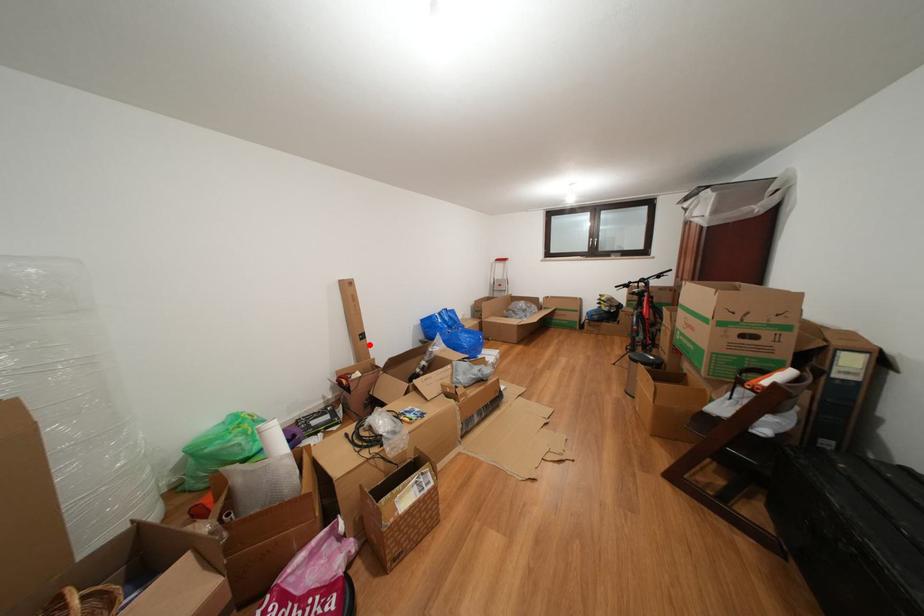
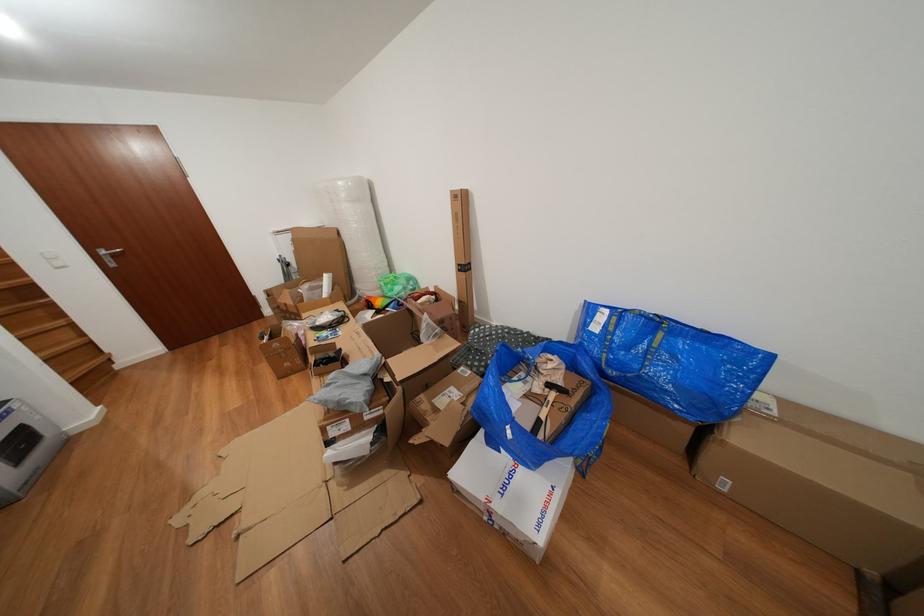
Question: I am providing you with two images of the same scene from different viewpoints. Given a red point in image1, look at the same physical point in image2. Is it:

Choices:
 (A) Closer to the viewpoint
 (B) Farther from the viewpoint

Answer: (B)